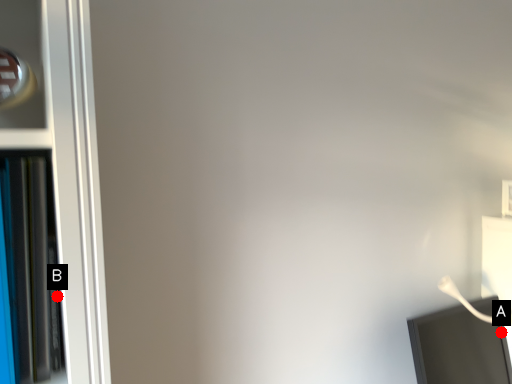
Question: Two points are circled on the image, labeled by A and B beside each circle. Which point appears farthest from the camera in this image?

Choices:
 (A) A is further
 (B) B is further

Answer: (A)